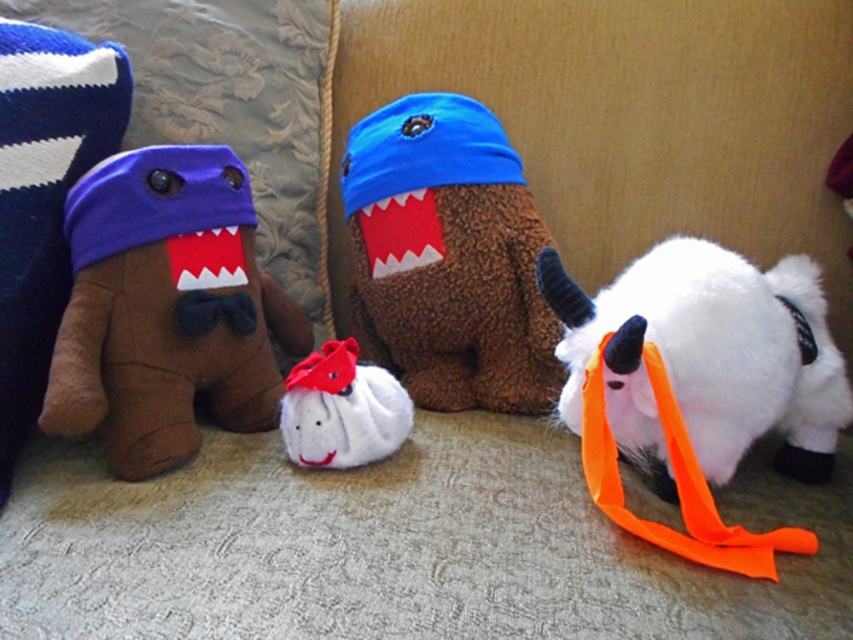
Question: Which object appears closest to the camera in this image?

Choices:
 (A) white fluffy goat at right
 (B) brown fuzzy stuffed toy at center

Answer: (A)

Question: Which point is farther to the camera?

Choices:
 (A) (398, 422)
 (B) (480, 275)
 (C) (651, 285)

Answer: (B)

Question: Does brown fuzzy stuffed toy at center come behind white fluffy goat at right?

Choices:
 (A) no
 (B) yes

Answer: (B)

Question: Is brown fuzzy stuffed toy at center bigger than white plush toy at center?

Choices:
 (A) yes
 (B) no

Answer: (A)

Question: Which of the following is the farthest from the observer?

Choices:
 (A) (723, 440)
 (B) (190, 284)
 (C) (440, 150)
 (D) (314, 451)

Answer: (C)

Question: From the image, what is the correct spatial relationship of white fluffy goat at right in relation to white plush toy at center?

Choices:
 (A) right
 (B) left

Answer: (A)